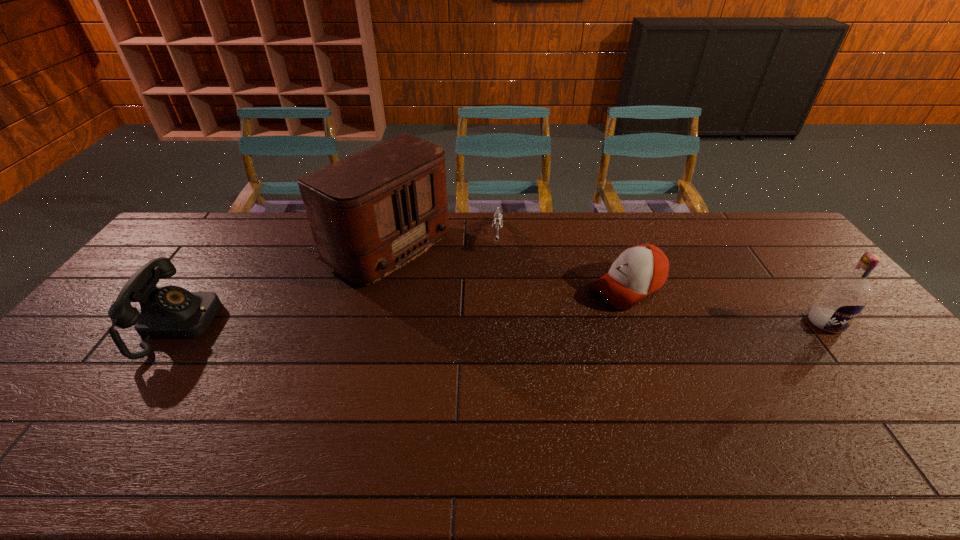
Where is `free region located on the dial of the telephone`? free region located on the dial of the telephone is located at coordinates (323, 325).

You are a GUI agent. You are given a task and a screenshot of the screen. Output one action in this format:
    pyautogui.click(x=<x>, y=<y>)
    Task: Click on the vacant region located on the label of the vodka
    The height and width of the screenshot is (540, 960).
    Given the screenshot: What is the action you would take?
    pyautogui.click(x=879, y=390)

At what (x,y) coordinates should I click in order to perform the action: click on free location located on the front panel of the tallest object. Please return your answer as a coordinate pair (x, y). This screenshot has height=540, width=960. Looking at the image, I should click on (481, 304).

The height and width of the screenshot is (540, 960). I want to click on vacant region located 0.400m on the front panel of the tallest object, so click(531, 332).

Locate an element on the screen. vacant area located 0.120m on the front panel of the tallest object is located at coordinates (456, 290).

Locate an element on the screen. The image size is (960, 540). vacant area located 0.330m on the front-facing side of the second object from right to left is located at coordinates (511, 349).

In order to click on vacant area situated on the front-facing side of the second object from right to left in this screenshot , I will do `click(505, 352)`.

Where is `vacant region located on the front-facing side of the second object from right to left`? vacant region located on the front-facing side of the second object from right to left is located at coordinates (568, 318).

I want to click on vacant space located 0.270m aimed along the barrel of the gun, so click(x=494, y=310).

Where is `free region located 0.340m aimed along the barrel of the gun`? free region located 0.340m aimed along the barrel of the gun is located at coordinates (493, 328).